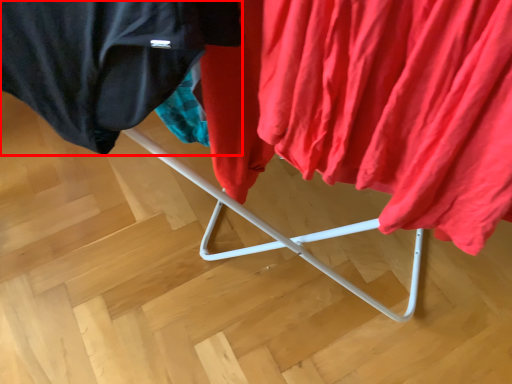
Question: From the image's perspective, considering the relative positions of cloak (annotated by the red box) and curtain in the image provided, where is cloak (annotated by the red box) located with respect to the staircase?

Choices:
 (A) above
 (B) below

Answer: (A)